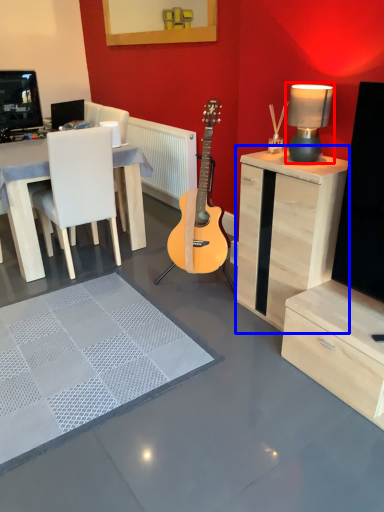
Question: Which of the following is the farthest to the observer, table lamp (highlighted by a red box) or cabinetry (highlighted by a blue box)?

Choices:
 (A) table lamp
 (B) cabinetry

Answer: (A)